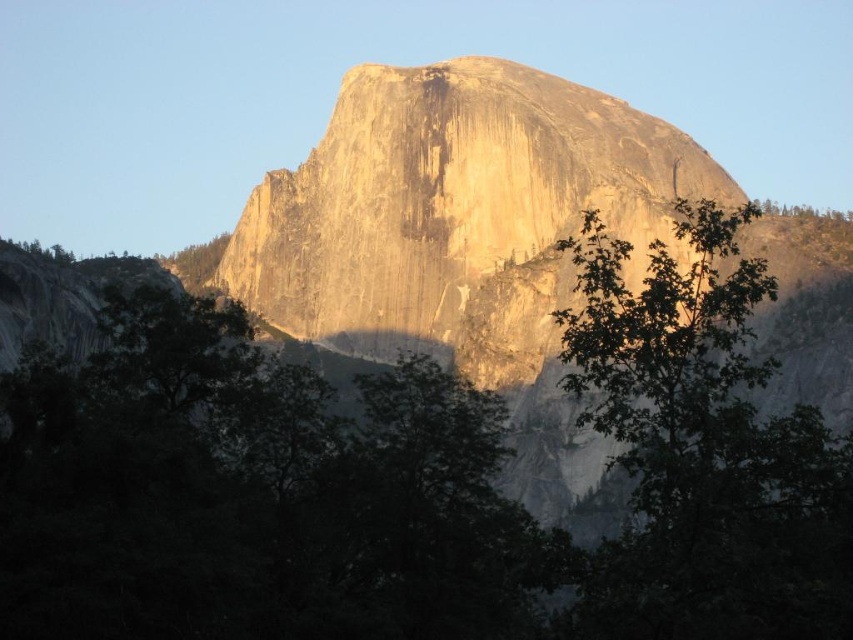
Question: Is green leafy tree at center wider than yellowish rock at center?

Choices:
 (A) yes
 (B) no

Answer: (A)

Question: In this image, where is green leafy tree at center located relative to green leafy tree at right?

Choices:
 (A) right
 (B) left

Answer: (B)

Question: Is green leafy tree at center below yellowish rock at center?

Choices:
 (A) no
 (B) yes

Answer: (B)

Question: Which point is closer to the camera taking this photo?

Choices:
 (A) (495, 400)
 (B) (775, 362)
 (C) (538, 184)

Answer: (B)

Question: Estimate the real-world distances between objects in this image. Which object is closer to the green leafy tree at center?

Choices:
 (A) green leafy tree at right
 (B) yellowish rock at center

Answer: (A)

Question: Which of the following is the closest to the observer?

Choices:
 (A) (407, 198)
 (B) (598, 353)
 (C) (480, 432)

Answer: (B)